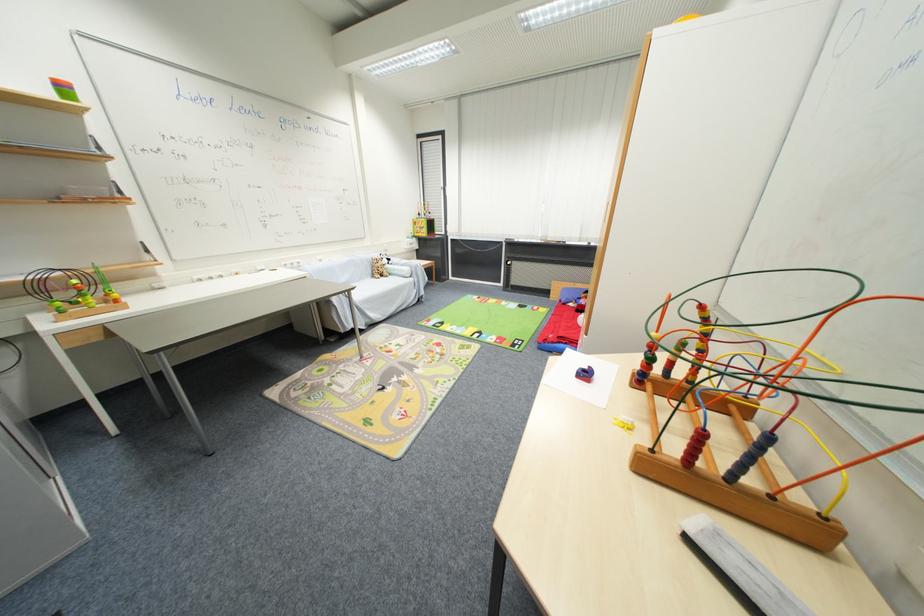
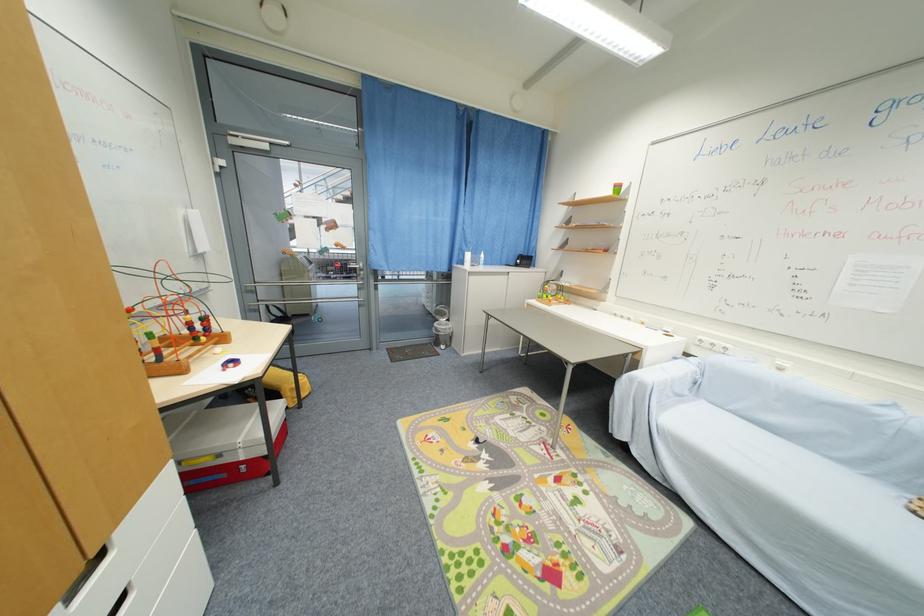
Locate, in the second image, the point that corresponds to point (300, 267) in the first image.

(723, 351)